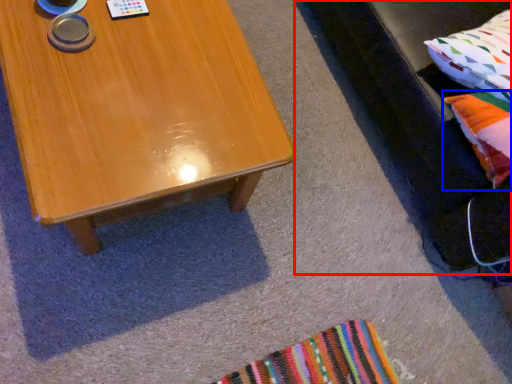
Question: Which object is closer to the camera taking this photo, couch (highlighted by a red box) or pillow (highlighted by a blue box)?

Choices:
 (A) couch
 (B) pillow

Answer: (A)